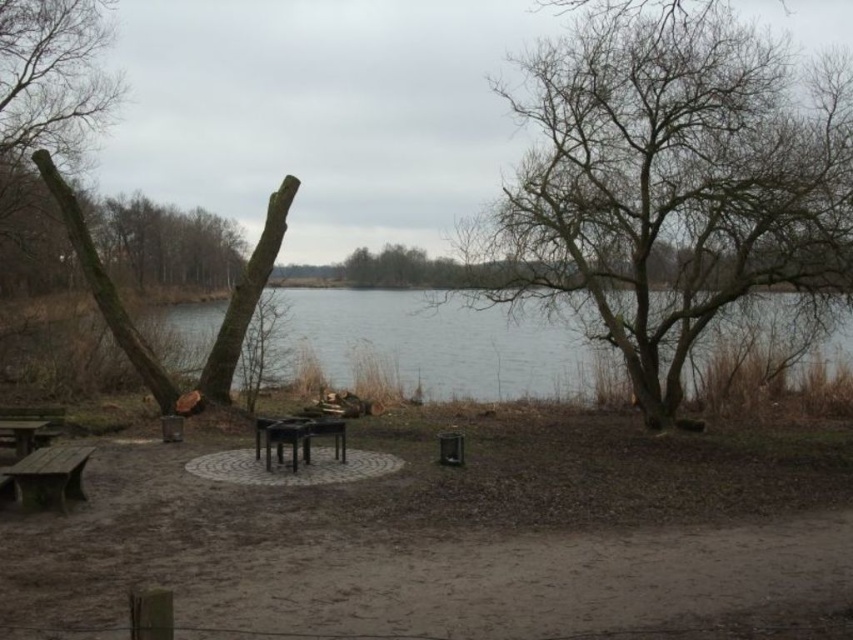
Question: Does wooden bench at lower left come behind black matte picnic table at center?

Choices:
 (A) no
 (B) yes

Answer: (A)

Question: Estimate the real-world distances between objects in this image. Which object is closer to the wooden bench at lower left?

Choices:
 (A) brown wood tree at upper left
 (B) bare wood tree at upper right

Answer: (B)

Question: Is bare wood tree at upper right wider than brown wood tree at upper left?

Choices:
 (A) no
 (B) yes

Answer: (B)

Question: Can you confirm if brown rough wood at left is positioned below black matte picnic table at center?

Choices:
 (A) yes
 (B) no

Answer: (B)

Question: Which point appears farthest from the camera in this image?

Choices:
 (A) (50, 188)
 (B) (693, 33)
 (C) (56, 451)

Answer: (A)

Question: Which point is closer to the camera?

Choices:
 (A) brown wooden table at lower left
 (B) black matte picnic table at center
 (C) brown wood tree at upper left
 (D) wooden bench at lower left

Answer: (D)